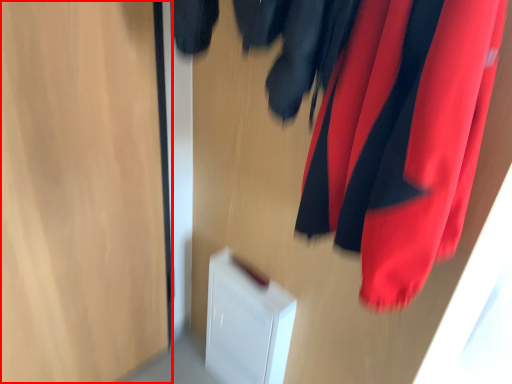
Question: Considering the relative positions of glass door (annotated by the red box) and curtain in the image provided, where is glass door (annotated by the red box) located with respect to the staircase?

Choices:
 (A) right
 (B) left

Answer: (B)